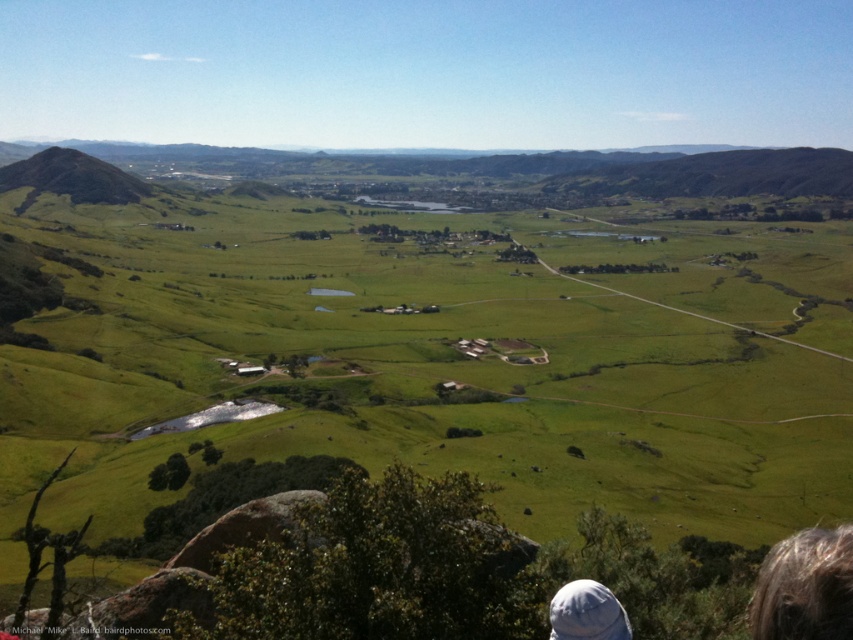
Question: Among these points, which one is nearest to the camera?

Choices:
 (A) (135, 198)
 (B) (843, 561)
 (C) (624, 636)

Answer: (B)

Question: Can you confirm if green grassy hill at left is bigger than white fabric cap at lower right?

Choices:
 (A) yes
 (B) no

Answer: (A)

Question: Which of the following is the farthest from the observer?

Choices:
 (A) green grassy hill at left
 (B) dark brown hair at lower right
 (C) white fabric cap at lower right

Answer: (A)

Question: Can you confirm if dark brown hair at lower right is bigger than green grassy hill at left?

Choices:
 (A) no
 (B) yes

Answer: (A)

Question: Which of the following is the closest to the observer?

Choices:
 (A) green grassy hill at left
 (B) white fabric cap at lower right
 (C) dark brown hair at lower right

Answer: (C)

Question: Is dark brown hair at lower right further to the viewer compared to green grassy hill at left?

Choices:
 (A) no
 (B) yes

Answer: (A)